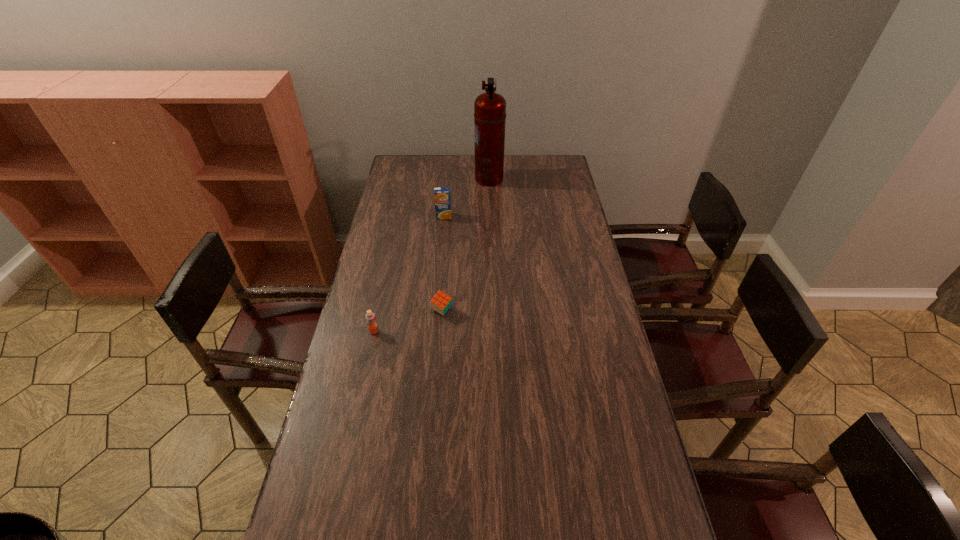
What are the coordinates of `vacant space at the far right corner` in the screenshot? It's located at (559, 156).

Find the location of a particular element. This screenshot has width=960, height=540. vacant space in between the cube and the shorter orange juice is located at coordinates 408,321.

Locate an element on the screen. free point between the rightmost object and the nearest object is located at coordinates (431, 255).

Locate an element on the screen. Image resolution: width=960 pixels, height=540 pixels. empty space between the cube and the tallest object is located at coordinates (466, 245).

Identify the location of empty space that is in between the second farthest object and the rightmost object. point(467,198).

The height and width of the screenshot is (540, 960). What are the coordinates of `free area in between the farthest object and the right orange juice` in the screenshot? It's located at (467, 198).

The image size is (960, 540). What are the coordinates of `free space between the shortest object and the tallest object` in the screenshot? It's located at (466, 245).

At what (x,y) coordinates should I click in order to perform the action: click on free space between the farthest object and the farther orange juice. Please return your answer as a coordinate pair (x, y). Looking at the image, I should click on (467, 198).

Where is `vacant space that's between the shorter orange juice and the tallest object`? This screenshot has height=540, width=960. vacant space that's between the shorter orange juice and the tallest object is located at coordinates (431, 255).

Identify the location of blank region between the rightmost object and the shortest object. This screenshot has width=960, height=540. (466, 245).